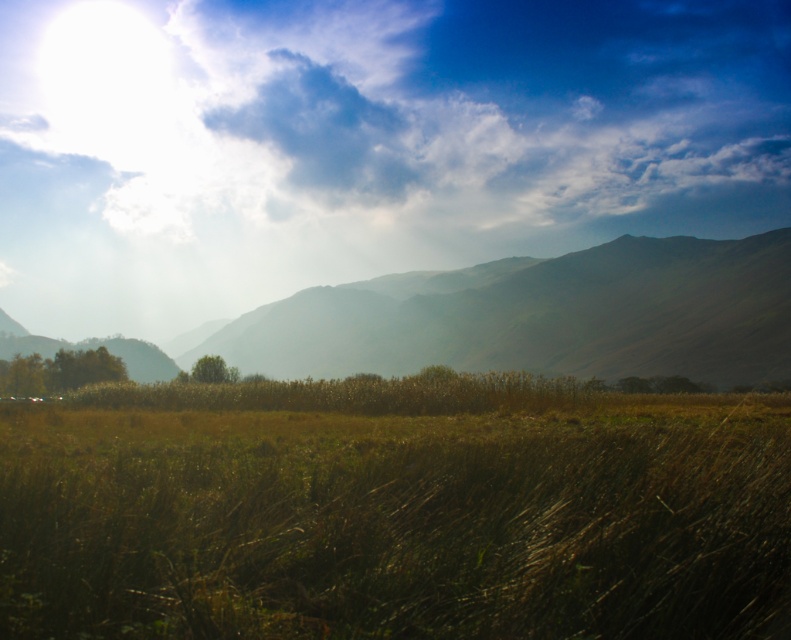
Does white fluffy cloud at upper center have a larger size compared to brown dry grass at center?

Indeed, white fluffy cloud at upper center has a larger size compared to brown dry grass at center.

How much distance is there between white fluffy cloud at upper center and brown dry grass at center?

white fluffy cloud at upper center and brown dry grass at center are 72.16 meters apart.

Identify the location of white fluffy cloud at upper center. (364, 144).

At what (x,y) coordinates should I click in order to perform the action: click on white fluffy cloud at upper center. Please return your answer as a coordinate pair (x, y). This screenshot has height=640, width=791. Looking at the image, I should click on (364, 144).

Who is lower down, white fluffy cloud at upper center or green matte mountain at center?

Positioned lower is green matte mountain at center.

Is white fluffy cloud at upper center behind green matte mountain at center?

That is True.

Is point (254, 282) positioned behind point (721, 380)?

Yes, point (254, 282) is behind point (721, 380).

Find the location of `white fluffy cloud at upper center`. white fluffy cloud at upper center is located at coordinates (364, 144).

Measure the distance between brown dry grass at center and camera.

brown dry grass at center and camera are 14.19 feet apart from each other.

Is brown dry grass at center closer to the viewer compared to green matte mountain at center?

Yes, brown dry grass at center is closer to the viewer.

Is point (670, 632) in front of point (243, 323)?

That is True.

Where is `brown dry grass at center`? This screenshot has width=791, height=640. brown dry grass at center is located at coordinates (400, 518).